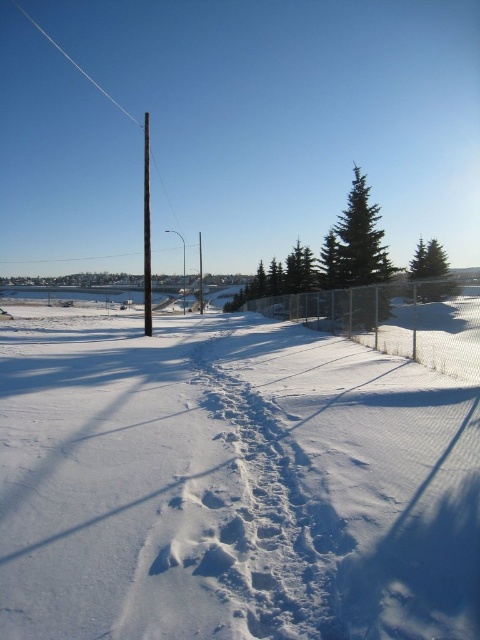
You are an animal tracker analyzing the snowy landscape. You notice the white powdery snow at center and the white wire at upper center. Which object is closer to the ground?

The white powdery snow at center is closer to the ground because it is shorter than the white wire at upper center.

You are standing in the snowy landscape and see the point marked at coordinates (395, 320). Based on the scene description, what object does this point correspond to?

The point at coordinates (395, 320) corresponds to the silver wire mesh fence at center.

You are an animal tracker analyzing the snowy landscape. You notice the white powdery snow at center and the white wire at upper center. Which object is larger in size?

The white wire at upper center is larger than the white powdery snow at center.